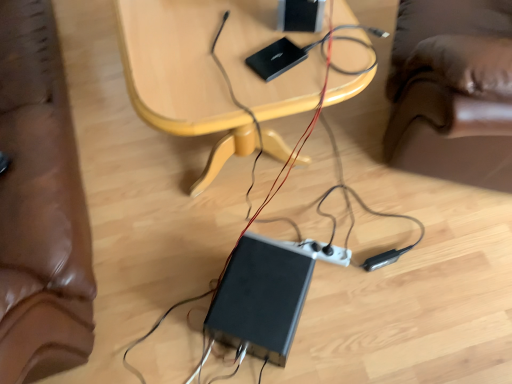
I want to click on wooden table at center, so click(x=211, y=71).

The height and width of the screenshot is (384, 512). What do you see at coordinates (211, 71) in the screenshot?
I see `wooden table at center` at bounding box center [211, 71].

What do you see at coordinates (261, 297) in the screenshot? I see `black plastic computer at lower center` at bounding box center [261, 297].

What are the coordinates of `black plastic computer at lower center` in the screenshot? It's located at (261, 297).

In order to face black plastic computer at lower center, should I rotate leftwards or rightwards?

Rotate your view right by about 1.116°.

Locate an element on the screen. wooden table at center is located at coordinates (211, 71).

Considering the relative positions of black plastic computer at lower center and wooden table at center in the image provided, is black plastic computer at lower center to the left or to the right of wooden table at center?

black plastic computer at lower center is to the right of wooden table at center.

Is the depth of black plastic computer at lower center less than that of wooden table at center?

No, black plastic computer at lower center is behind wooden table at center.

Which point is more forward, [218,337] or [254,131]?

The point [218,337] is in front.

From the image's perspective, which is above, black plastic computer at lower center or wooden table at center?

wooden table at center appears higher in the image.

From a real-world perspective, is black plastic computer at lower center above or below wooden table at center?

Clearly, from a real-world perspective, black plastic computer at lower center is below wooden table at center.

Between black plastic computer at lower center and wooden table at center, which one has smaller width?

Thinner between the two is black plastic computer at lower center.

Considering the sizes of objects black plastic computer at lower center and wooden table at center in the image provided, who is shorter, black plastic computer at lower center or wooden table at center?

black plastic computer at lower center is shorter.

Is black plastic computer at lower center bigger or smaller than wooden table at center?

Clearly, black plastic computer at lower center is smaller in size than wooden table at center.

Is black plastic computer at lower center not inside wooden table at center?

Indeed, black plastic computer at lower center is completely outside wooden table at center.

Is black plastic computer at lower center touching wooden table at center?

No, black plastic computer at lower center is not next to wooden table at center.

Could you tell me if black plastic computer at lower center is turned towards wooden table at center?

Yes, black plastic computer at lower center is turned towards wooden table at center.

What's the angular difference between black plastic computer at lower center and wooden table at center's facing directions?

The facing directions of black plastic computer at lower center and wooden table at center are 54.2 degrees apart.

How far apart are black plastic computer at lower center and wooden table at center?

They are 19.04 inches apart.

Find the location of a particular element. The height and width of the screenshot is (384, 512). table in front of the black plastic computer at lower center is located at coordinates (211, 71).

Which is more to the right, wooden table at center or black plastic computer at lower center?

From the viewer's perspective, black plastic computer at lower center appears more on the right side.

Considering their positions, is wooden table at center located in front of or behind black plastic computer at lower center?

wooden table at center is in front of black plastic computer at lower center.

Is point (150, 59) positioned behind point (273, 255)?

No, (150, 59) is closer to viewer.

Consider the image. From the image's perspective, which is above, wooden table at center or black plastic computer at lower center?

wooden table at center.

From a real-world perspective, is wooden table at center located higher than black plastic computer at lower center?

Indeed, from a real-world perspective, wooden table at center stands above black plastic computer at lower center.

Between wooden table at center and black plastic computer at lower center, which one has larger width?

wooden table at center is wider.

Can you confirm if wooden table at center is shorter than black plastic computer at lower center?

In fact, wooden table at center may be taller than black plastic computer at lower center.

Looking at the image, does wooden table at center seem bigger or smaller compared to black plastic computer at lower center?

Considering their sizes, wooden table at center takes up more space than black plastic computer at lower center.

Looking at this image, would you say wooden table at center contains black plastic computer at lower center?

No, black plastic computer at lower center is located outside of wooden table at center.

Are wooden table at center and black plastic computer at lower center making contact?

No, wooden table at center is not beside black plastic computer at lower center.

Is black plastic computer at lower center at the back of wooden table at center?

wooden table at center is not turned away from black plastic computer at lower center.

How many degrees apart are the facing directions of wooden table at center and black plastic computer at lower center?

The angular difference between wooden table at center and black plastic computer at lower center is 54.2 degrees.

The width and height of the screenshot is (512, 384). Find the location of `table located in front of the black plastic computer at lower center`. table located in front of the black plastic computer at lower center is located at coordinates (211, 71).

You are a GUI agent. You are given a task and a screenshot of the screen. Output one action in this format:
    pyautogui.click(x=<x>, y=<y>)
    Task: Click on the computer that is behind the wooden table at center
    Image resolution: width=512 pixels, height=384 pixels.
    Given the screenshot: What is the action you would take?
    pyautogui.click(x=261, y=297)

Where is `computer below the wooden table at center (from the image's perspective)`? computer below the wooden table at center (from the image's perspective) is located at coordinates (261, 297).